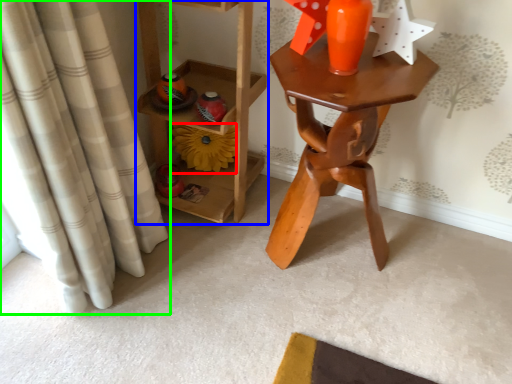
Question: Which object is positioned closest to flower (highlighted by a red box)? Select from furniture (highlighted by a blue box) and curtain (highlighted by a green box).

Choices:
 (A) furniture
 (B) curtain

Answer: (A)